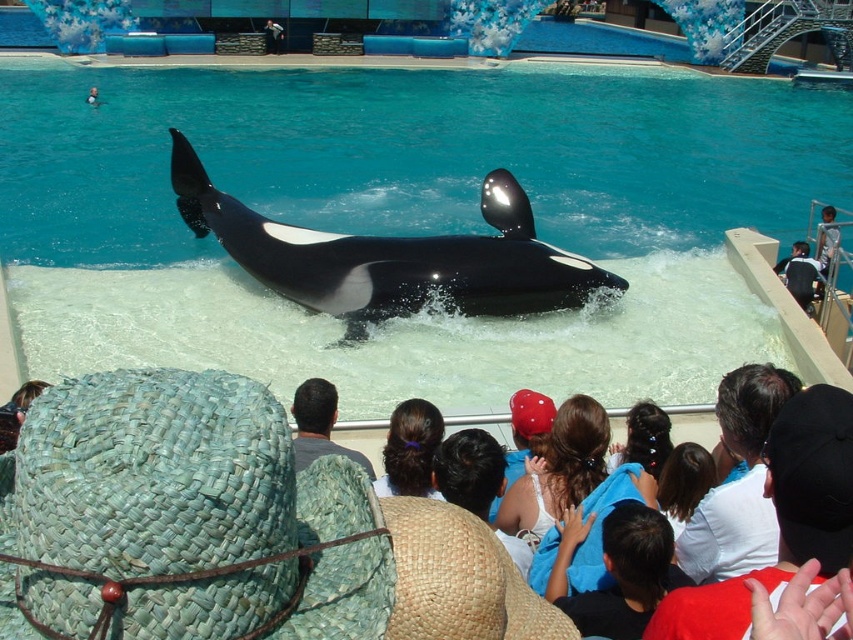
Question: Which point is farther to the camera?

Choices:
 (A) (405, 401)
 (B) (744, 460)

Answer: (A)

Question: Considering the real-world distances, which object is farthest from the blue woven hat at lower center?

Choices:
 (A) blue woven hat at center
 (B) dark gray woven hat at center

Answer: (B)

Question: Can you confirm if clear blue water at upper center is smaller than white cotton shirt at upper right?

Choices:
 (A) yes
 (B) no

Answer: (B)

Question: Is clear blue water at upper center wider than woven straw hat at lower left?

Choices:
 (A) no
 (B) yes

Answer: (B)

Question: Can you confirm if blue woven hat at lower center is thinner than dark gray woven hat at center?

Choices:
 (A) yes
 (B) no

Answer: (B)

Question: Which of the following is the closest to the observer?

Choices:
 (A) blue woven hat at center
 (B) black smooth whale at center
 (C) clear blue water at upper center

Answer: (A)